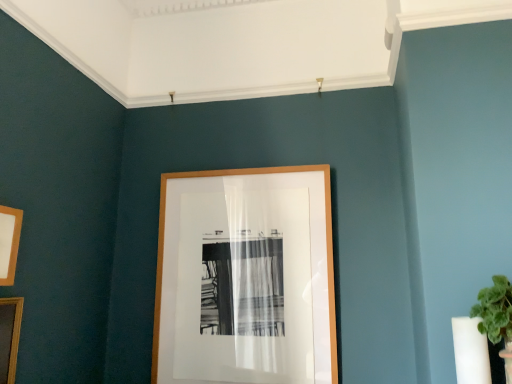
Question: Is wooden picture frame at left, which is the second picture frame in right-to-left order, at the back of wooden picture frame at lower left, which is counted as the 3th picture frame, starting from the back?

Choices:
 (A) no
 (B) yes

Answer: (A)

Question: From a real-world perspective, is wooden picture frame at lower left, which is counted as the 3th picture frame, starting from the back, over wooden picture frame at left, the 2th picture frame in the left-to-right sequence?

Choices:
 (A) no
 (B) yes

Answer: (A)

Question: Is wooden picture frame at left, acting as the second picture frame starting from the back, surrounded by wooden picture frame at lower left, the first picture frame positioned from the left?

Choices:
 (A) no
 (B) yes

Answer: (A)

Question: Is wooden picture frame at lower left, the first picture frame positioned from the left, further to camera compared to wooden picture frame at left, acting as the second picture frame starting from the back?

Choices:
 (A) no
 (B) yes

Answer: (A)

Question: From a real-world perspective, is wooden picture frame at lower left, which is the first picture frame from front to back, under wooden picture frame at left, which is the second picture frame in right-to-left order?

Choices:
 (A) yes
 (B) no

Answer: (A)

Question: Does wooden picture frame at lower left, the first picture frame positioned from the left, have a greater width compared to wooden picture frame at left, acting as the second picture frame starting from the back?

Choices:
 (A) no
 (B) yes

Answer: (A)

Question: Considering the relative sizes of wooden picture frame at center, marked as the 3th picture frame in a front-to-back arrangement, and wooden picture frame at left, the 2th picture frame in the left-to-right sequence, in the image provided, is wooden picture frame at center, marked as the 3th picture frame in a front-to-back arrangement, taller than wooden picture frame at left, the 2th picture frame in the left-to-right sequence,?

Choices:
 (A) no
 (B) yes

Answer: (B)

Question: Considering the relative sizes of wooden picture frame at center, the 1th picture frame viewed from the right, and wooden picture frame at left, acting as the second picture frame starting from the front, in the image provided, is wooden picture frame at center, the 1th picture frame viewed from the right, thinner than wooden picture frame at left, acting as the second picture frame starting from the front,?

Choices:
 (A) yes
 (B) no

Answer: (B)

Question: From the image's perspective, does wooden picture frame at center, the 1th picture frame viewed from the right, appear lower than wooden picture frame at left, acting as the second picture frame starting from the back?

Choices:
 (A) no
 (B) yes

Answer: (B)

Question: From the image's perspective, is wooden picture frame at center, which ranks as the 1th picture frame in back-to-front order, on top of wooden picture frame at left, acting as the second picture frame starting from the back?

Choices:
 (A) yes
 (B) no

Answer: (B)

Question: From a real-world perspective, is wooden picture frame at center, the 1th picture frame viewed from the right, physically above wooden picture frame at left, acting as the second picture frame starting from the front?

Choices:
 (A) no
 (B) yes

Answer: (A)

Question: Does wooden picture frame at center, marked as the 3th picture frame in a front-to-back arrangement, touch wooden picture frame at left, acting as the second picture frame starting from the front?

Choices:
 (A) no
 (B) yes

Answer: (A)

Question: Does wooden picture frame at lower left, which is the first picture frame from front to back, have a larger size compared to wooden picture frame at center, positioned as the third picture frame in left-to-right order?

Choices:
 (A) yes
 (B) no

Answer: (B)